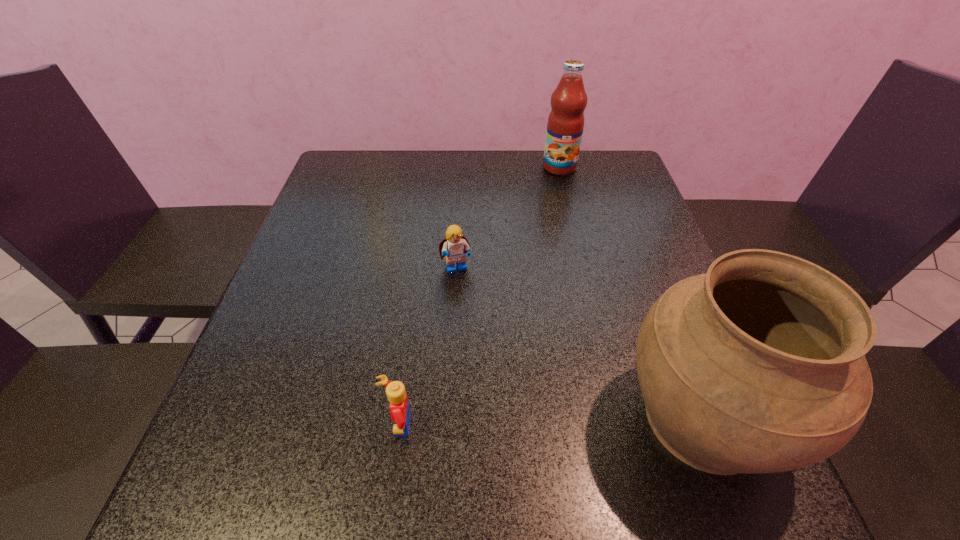
What are the coordinates of `fruit juice present at the right edge` in the screenshot? It's located at (565, 125).

Find the location of a particular element. object that is at the far right corner is located at coordinates (565, 125).

The width and height of the screenshot is (960, 540). Find the location of `object located in the near right corner section of the desktop`. object located in the near right corner section of the desktop is located at coordinates (758, 366).

This screenshot has width=960, height=540. Find the location of `vacant space at the far edge of the desktop`. vacant space at the far edge of the desktop is located at coordinates (461, 158).

Locate an element on the screen. The height and width of the screenshot is (540, 960). vacant space at the near edge of the desktop is located at coordinates (376, 414).

The width and height of the screenshot is (960, 540). I want to click on vacant space at the left edge of the desktop, so click(287, 310).

Find the location of a particular element. vacant space at the right edge is located at coordinates (606, 194).

Identify the location of vacant region at the far left corner of the desktop. (386, 156).

This screenshot has width=960, height=540. In the image, there is a desktop. Identify the location of vacant space at the near left corner. (291, 434).

You are a GUI agent. You are given a task and a screenshot of the screen. Output one action in this format:
    pyautogui.click(x=<x>, y=<y>)
    Task: Click on the vacant region at the far right corner of the desktop
    Image resolution: width=960 pixels, height=540 pixels.
    Given the screenshot: What is the action you would take?
    pyautogui.click(x=623, y=167)